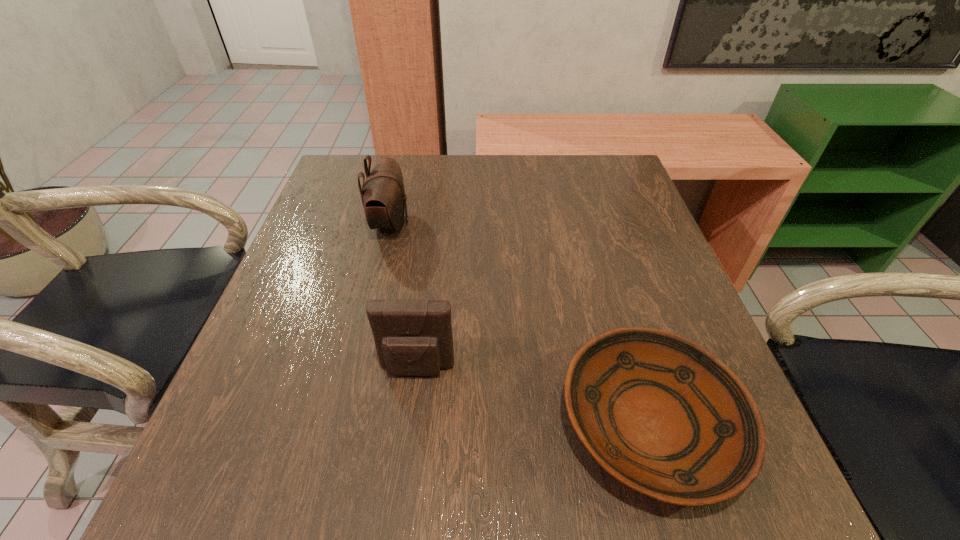
This screenshot has width=960, height=540. I want to click on the second closest object to the plate, so click(x=383, y=196).

What are the coordinates of `free spot that satisfies the following two spatial constraints: 1. with an open flap on the shortest object; 2. on the left side of the nearer pouch` in the screenshot? It's located at (411, 423).

Image resolution: width=960 pixels, height=540 pixels. Find the location of `vacant region that satisfies the following two spatial constraints: 1. with the flap open on the plate; 2. on the right side of the farther pouch`. vacant region that satisfies the following two spatial constraints: 1. with the flap open on the plate; 2. on the right side of the farther pouch is located at coordinates (343, 423).

Where is `vacant region that satisfies the following two spatial constraints: 1. on the back side of the shortest object; 2. with the flap open on the farthest object`? vacant region that satisfies the following two spatial constraints: 1. on the back side of the shortest object; 2. with the flap open on the farthest object is located at coordinates [x=591, y=224].

Image resolution: width=960 pixels, height=540 pixels. What are the coordinates of `blank area in the image that satisfies the following two spatial constraints: 1. on the back side of the rightmost object; 2. with the flap open on the farther pouch` in the screenshot? It's located at (591, 224).

At what (x,y) coordinates should I click in order to perform the action: click on vacant space that satisfies the following two spatial constraints: 1. with an open flap on the rightmost object; 2. on the right side of the nearer pouch. Please return your answer as a coordinate pair (x, y). The image size is (960, 540). Looking at the image, I should click on (411, 423).

Where is `vacant area in the image that satisfies the following two spatial constraints: 1. with the flap open on the rightmost object; 2. on the left side of the farthest object`? The height and width of the screenshot is (540, 960). vacant area in the image that satisfies the following two spatial constraints: 1. with the flap open on the rightmost object; 2. on the left side of the farthest object is located at coordinates (343, 423).

At what (x,y) coordinates should I click in order to perform the action: click on free spot that satisfies the following two spatial constraints: 1. with the flap open on the farthest object; 2. on the right side of the rightmost object. Please return your answer as a coordinate pair (x, y). The width and height of the screenshot is (960, 540). Looking at the image, I should click on (343, 423).

Image resolution: width=960 pixels, height=540 pixels. What are the coordinates of `vacant space that satisfies the following two spatial constraints: 1. with an open flap on the shortest object; 2. on the left side of the nearer pouch` in the screenshot? It's located at (411, 423).

In order to click on vacant position in the image that satisfies the following two spatial constraints: 1. with the flap open on the farther pouch; 2. on the left side of the plate in this screenshot , I will do `click(343, 423)`.